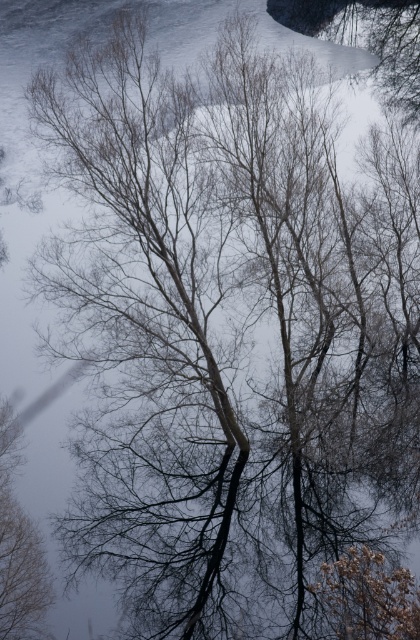
Question: Which point is farther to the camera?

Choices:
 (A) (401, 577)
 (B) (36, 540)

Answer: (B)

Question: Which point appears farthest from the camera in this image?

Choices:
 (A) (330, 621)
 (B) (0, 515)

Answer: (B)

Question: Does brown textured tree at lower right have a lesser width compared to brown matte tree at left?

Choices:
 (A) no
 (B) yes

Answer: (A)

Question: Is brown textured tree at lower right bigger than brown matte tree at left?

Choices:
 (A) no
 (B) yes

Answer: (A)

Question: Which of the following is the closest to the observer?

Choices:
 (A) brown textured tree at lower right
 (B) brown matte tree at left

Answer: (A)

Question: Is brown textured tree at lower right positioned at the back of brown matte tree at left?

Choices:
 (A) no
 (B) yes

Answer: (A)